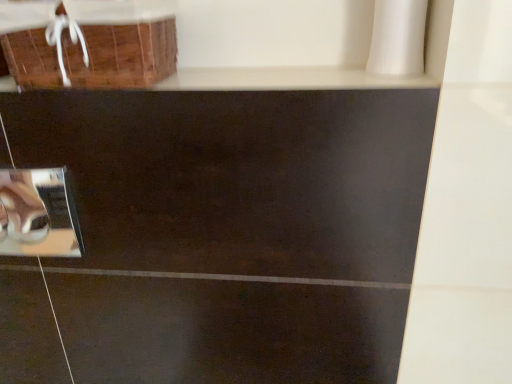
Question: Is brown woven basket at upper left closer to camera compared to metallic silver mirror at lower left?

Choices:
 (A) no
 (B) yes

Answer: (B)

Question: From the image's perspective, is brown woven basket at upper left under metallic silver mirror at lower left?

Choices:
 (A) yes
 (B) no

Answer: (B)

Question: From a real-world perspective, does brown woven basket at upper left stand above metallic silver mirror at lower left?

Choices:
 (A) yes
 (B) no

Answer: (A)

Question: Can we say brown woven basket at upper left lies outside metallic silver mirror at lower left?

Choices:
 (A) yes
 (B) no

Answer: (A)

Question: Can you confirm if brown woven basket at upper left is bigger than metallic silver mirror at lower left?

Choices:
 (A) no
 (B) yes

Answer: (B)

Question: Is brown woven basket at upper left touching metallic silver mirror at lower left?

Choices:
 (A) no
 (B) yes

Answer: (A)

Question: Considering the relative positions of metallic silver mirror at lower left and brown woven basket at upper left in the image provided, is metallic silver mirror at lower left to the right of brown woven basket at upper left from the viewer's perspective?

Choices:
 (A) no
 (B) yes

Answer: (A)

Question: Considering the relative sizes of metallic silver mirror at lower left and brown woven basket at upper left in the image provided, is metallic silver mirror at lower left bigger than brown woven basket at upper left?

Choices:
 (A) no
 (B) yes

Answer: (A)

Question: From the image's perspective, is metallic silver mirror at lower left below brown woven basket at upper left?

Choices:
 (A) no
 (B) yes

Answer: (B)

Question: Is metallic silver mirror at lower left taller than brown woven basket at upper left?

Choices:
 (A) no
 (B) yes

Answer: (B)

Question: Is brown woven basket at upper left inside metallic silver mirror at lower left?

Choices:
 (A) no
 (B) yes

Answer: (A)

Question: Is metallic silver mirror at lower left facing away from brown woven basket at upper left?

Choices:
 (A) no
 (B) yes

Answer: (A)

Question: From a real-world perspective, is metallic silver mirror at lower left physically located above or below brown woven basket at upper left?

Choices:
 (A) above
 (B) below

Answer: (B)